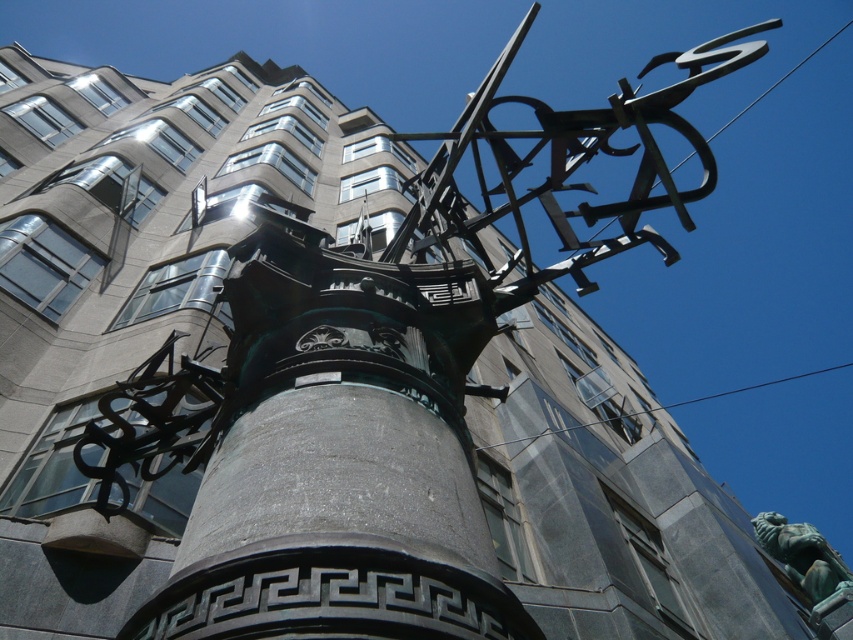
Does green patina stone pillar at center appear on the left side of green patina statue at lower right?

Correct, you'll find green patina stone pillar at center to the left of green patina statue at lower right.

Locate an element on the screen. The image size is (853, 640). green patina stone pillar at center is located at coordinates (339, 456).

At what (x,y) coordinates should I click in order to perform the action: click on green patina stone pillar at center. Please return your answer as a coordinate pair (x, y). Looking at the image, I should click on (339, 456).